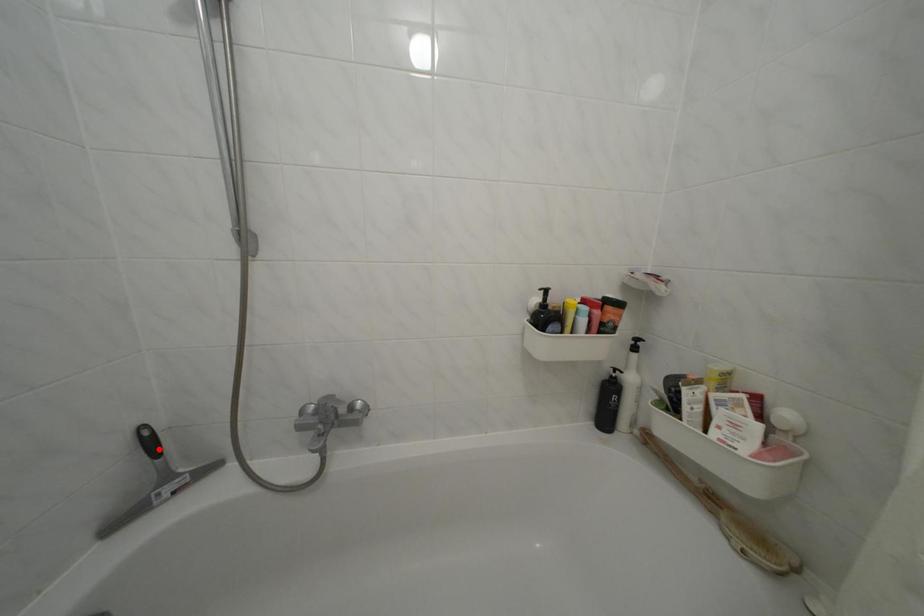
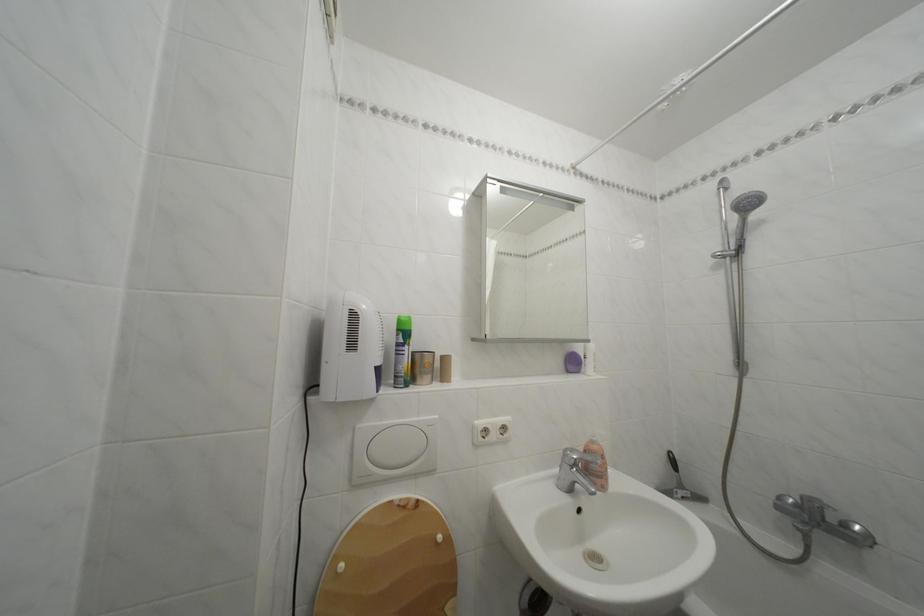
The point at the highlighted location is marked in the first image. Where is the corresponding point in the second image?

(682, 468)